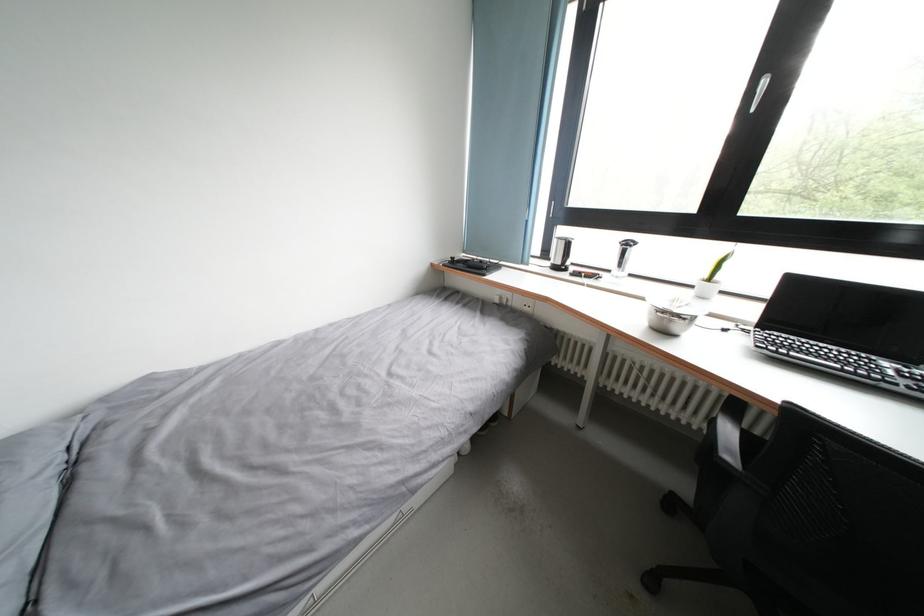
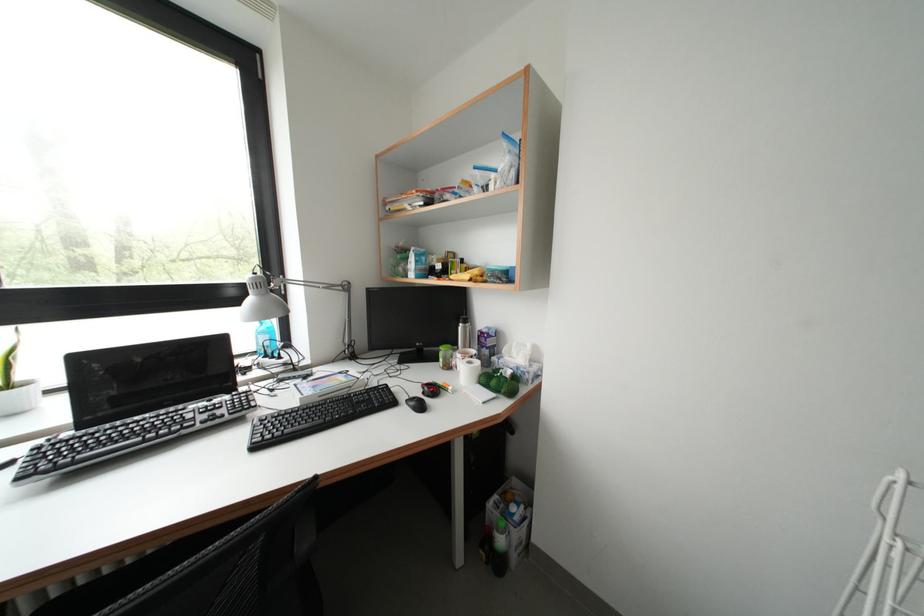
Question: The first image is from the beginning of the video and the second image is from the end. How did the camera likely rotate when shooting the video?

Choices:
 (A) Left
 (B) Right
 (C) Up
 (D) Down

Answer: (B)